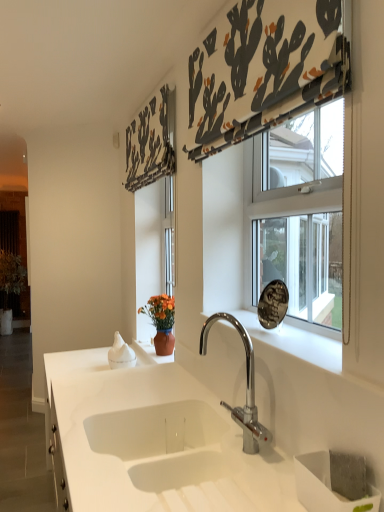
Question: From a real-world perspective, is white fabric with cactus print at upper center, the second curtain in the left-to-right sequence, located higher than wooden screen door at left?

Choices:
 (A) no
 (B) yes

Answer: (B)

Question: Would you consider white fabric with cactus print at upper center, which is the first curtain in right-to-left order, to be distant from wooden screen door at left?

Choices:
 (A) yes
 (B) no

Answer: (A)

Question: Is white fabric with cactus print at upper center, the first curtain when ordered from front to back, shorter than wooden screen door at left?

Choices:
 (A) yes
 (B) no

Answer: (A)

Question: Is white fabric with cactus print at upper center, the second curtain in the left-to-right sequence, taller than wooden screen door at left?

Choices:
 (A) no
 (B) yes

Answer: (A)

Question: Can you confirm if white fabric with cactus print at upper center, the first curtain when ordered from front to back, is wider than wooden screen door at left?

Choices:
 (A) no
 (B) yes

Answer: (A)

Question: In the image, is white fabric with cactus print at upper center, which is counted as the 2th curtain, starting from the back, positioned in front of or behind wooden screen door at left?

Choices:
 (A) behind
 (B) front

Answer: (B)

Question: Considering the positions of point (297, 45) and point (18, 202), is point (297, 45) closer or farther from the camera than point (18, 202)?

Choices:
 (A) closer
 (B) farther

Answer: (A)

Question: Looking at the image, does white fabric with cactus print at upper center, which is the first curtain in right-to-left order, seem bigger or smaller compared to wooden screen door at left?

Choices:
 (A) small
 (B) big

Answer: (A)

Question: Would you say white fabric with cactus print at upper center, the first curtain when ordered from front to back, is to the left or to the right of wooden screen door at left in the picture?

Choices:
 (A) left
 (B) right

Answer: (B)

Question: From a real-world perspective, is black fabric with cactus print at upper center, which ranks as the first curtain in left-to-right order, physically located above or below white fabric with cactus print at upper center, which is counted as the 2th curtain, starting from the back?

Choices:
 (A) below
 (B) above

Answer: (A)

Question: Is black fabric with cactus print at upper center, arranged as the 1th curtain when viewed from the back, in front of or behind white fabric with cactus print at upper center, the first curtain when ordered from front to back, in the image?

Choices:
 (A) behind
 (B) front

Answer: (A)

Question: Is black fabric with cactus print at upper center, which ranks as the first curtain in left-to-right order, to the left or to the right of white fabric with cactus print at upper center, the second curtain in the left-to-right sequence, in the image?

Choices:
 (A) right
 (B) left

Answer: (B)

Question: Based on their sizes in the image, would you say black fabric with cactus print at upper center, arranged as the second curtain when viewed from the front, is bigger or smaller than white fabric with cactus print at upper center, which is the first curtain in right-to-left order?

Choices:
 (A) big
 (B) small

Answer: (A)

Question: From a real-world perspective, is white marble window sill at center above or below white fabric with cactus print at upper center, which is the first curtain in right-to-left order?

Choices:
 (A) above
 (B) below

Answer: (B)

Question: In the image, is white marble window sill at center positioned in front of or behind white fabric with cactus print at upper center, the second curtain in the left-to-right sequence?

Choices:
 (A) behind
 (B) front

Answer: (A)